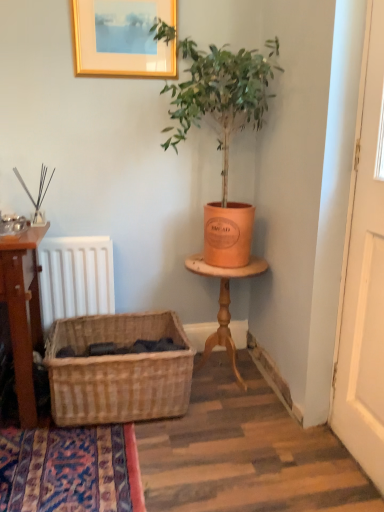
Find the location of `empty space that is in between wooden table at right and woven natural basket at lower left`. empty space that is in between wooden table at right and woven natural basket at lower left is located at coordinates (229, 400).